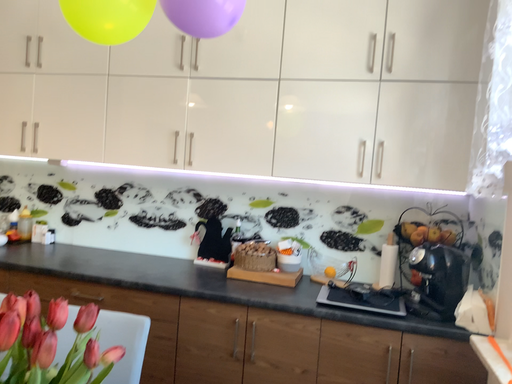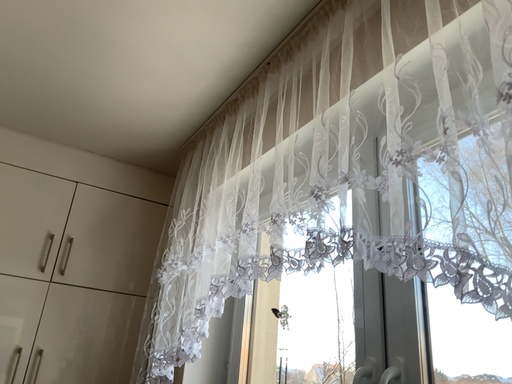
Question: How did the camera likely rotate when shooting the video?

Choices:
 (A) rotated upward
 (B) rotated downward

Answer: (A)